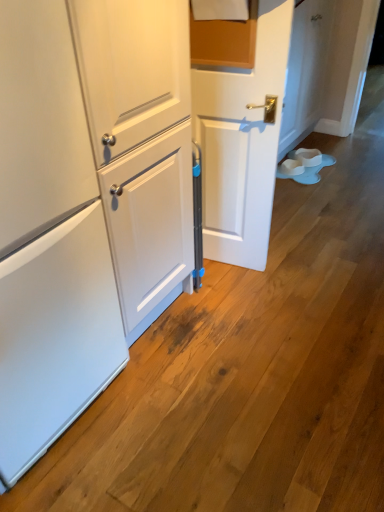
What is the approximate height of white matte door at center?

white matte door at center is 4.04 feet tall.

Describe the element at coordinates (242, 142) in the screenshot. I see `white matte door at center` at that location.

What are the coordinates of `white matte door at center` in the screenshot? It's located at (242, 142).

Identify the location of white matte door at center. (242, 142).